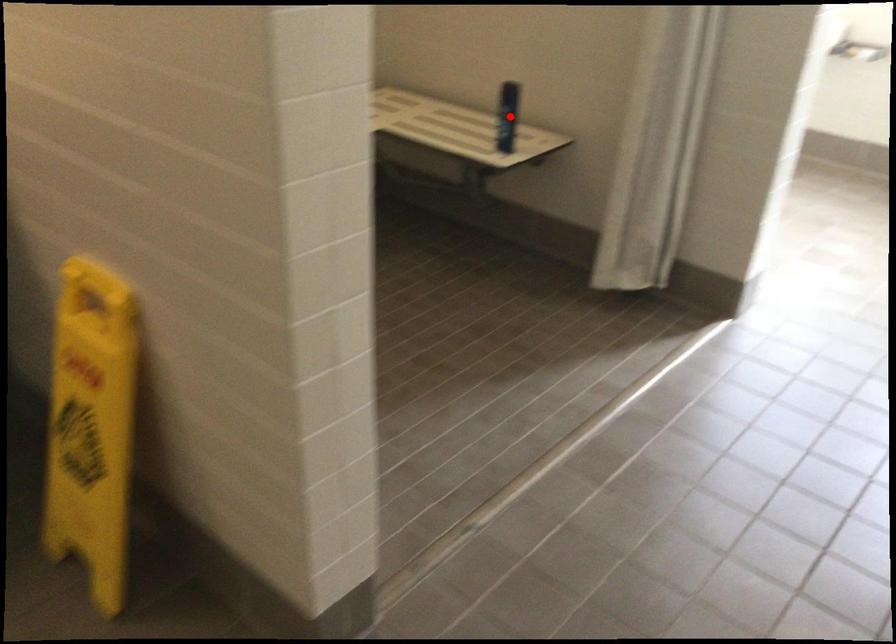
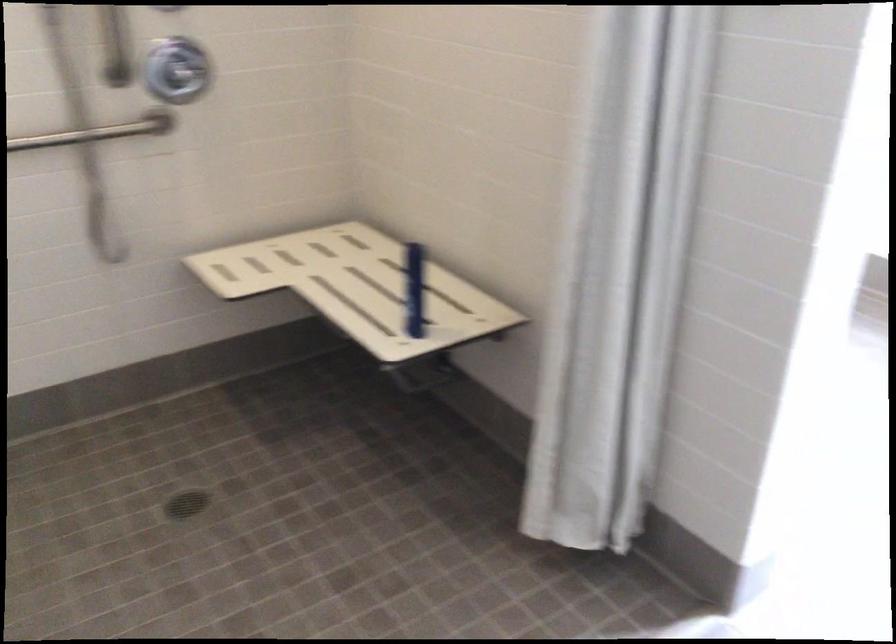
Question: I am providing you with two images of the same scene from different viewpoints. Given a red point in image1, look at the same physical point in image2. Is it:

Choices:
 (A) Closer to the viewpoint
 (B) Farther from the viewpoint

Answer: (A)